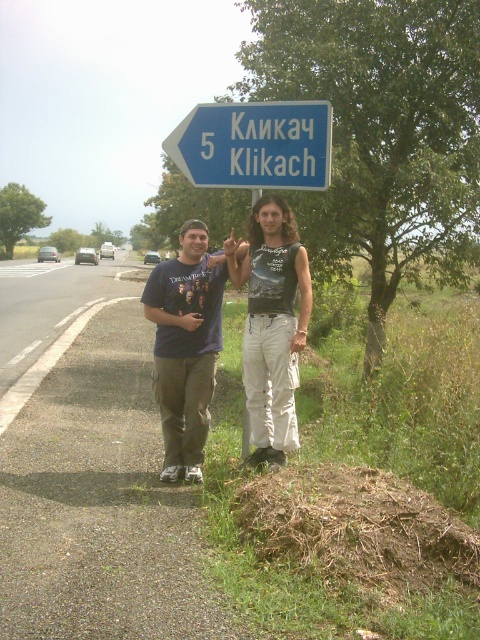
You are taking a photo of the dark gray sleeveless shirt at center and the blue plastic sign at upper center. Which object is closer to the camera?

The dark gray sleeveless shirt at center is closer to the camera because it is in front of the blue plastic sign at upper center.